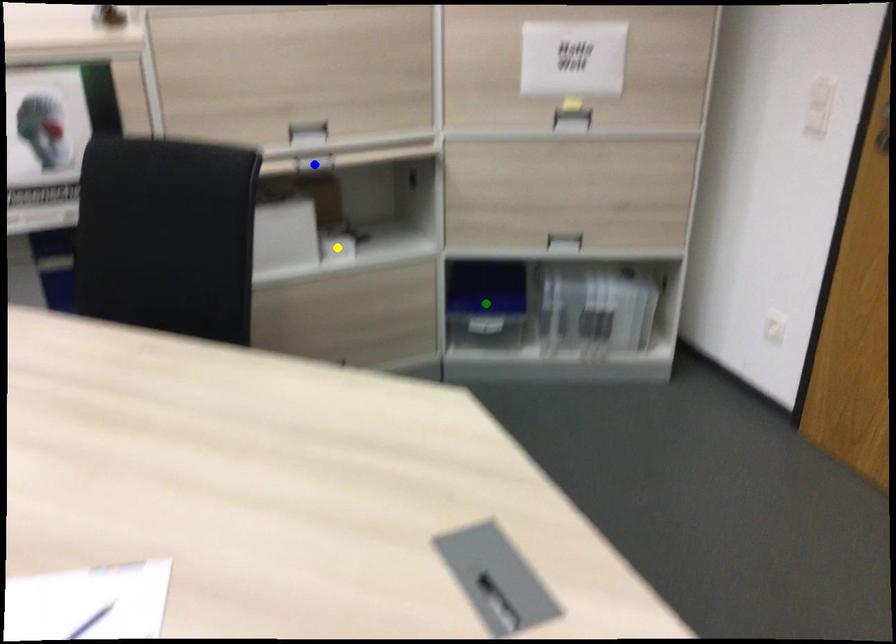
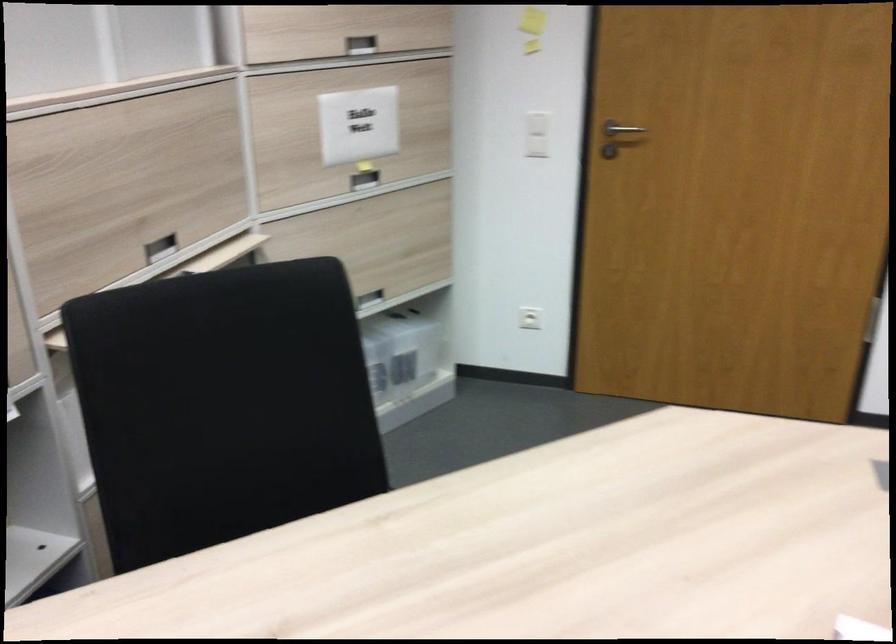
I am providing you with two images of the same scene from different viewpoints. Three points are marked in image1. Which point corresponds to a part or object that is occluded in image2?In image1, three points are marked. Which of them correspond to a part or object that is occluded in image2?Among the three points shown in image1, which one corresponds to a part or object that is no longer visible due to occlusion in image2?

Invisible in image2: blue point, green point, yellow point.